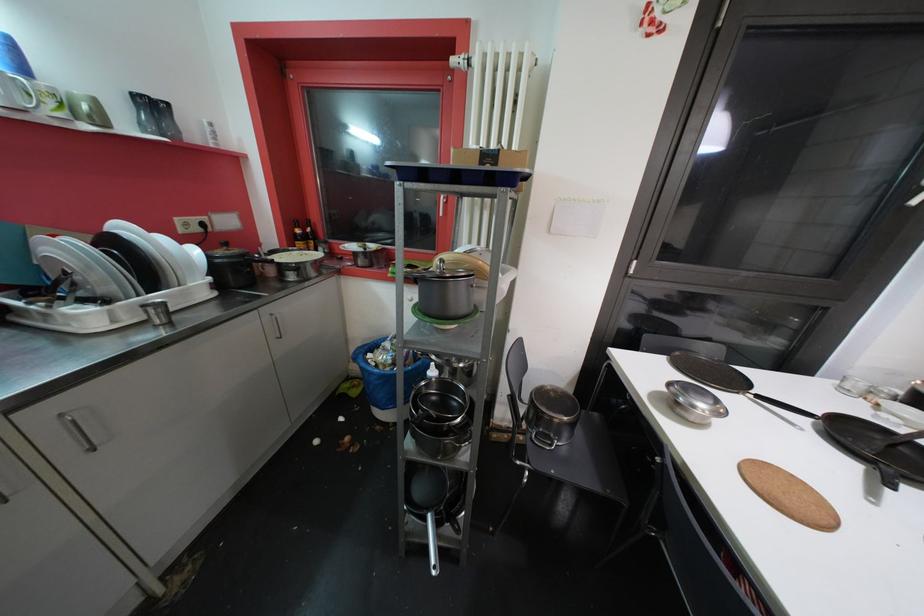
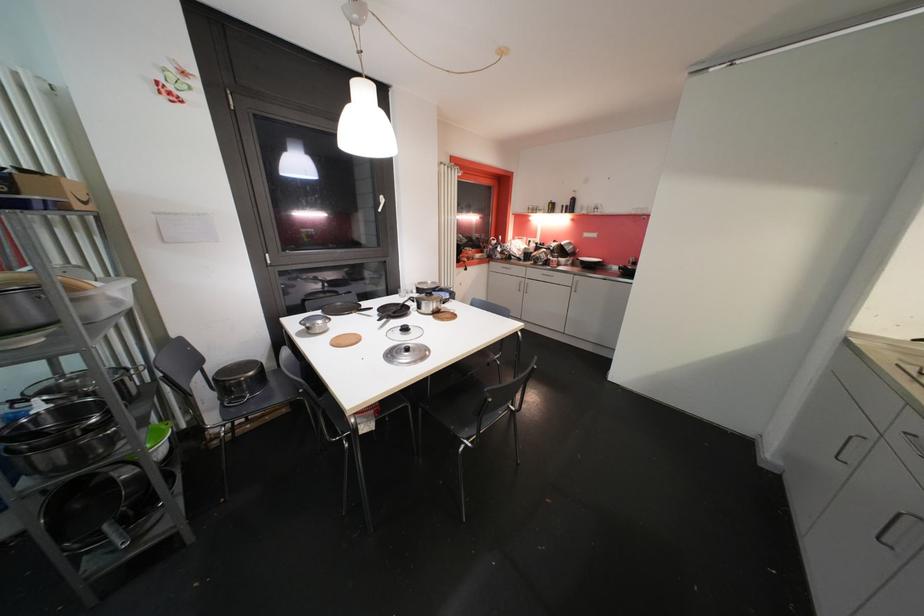
Find the pixel in the second image that matches the point at 699,408 in the first image.

(319, 328)